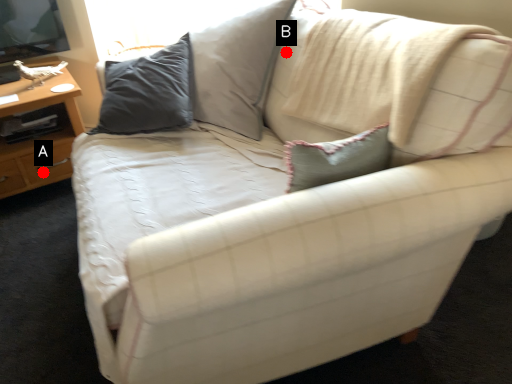
Question: Two points are circled on the image, labeled by A and B beside each circle. Which point is closer to the camera taking this photo?

Choices:
 (A) A is closer
 (B) B is closer

Answer: (B)